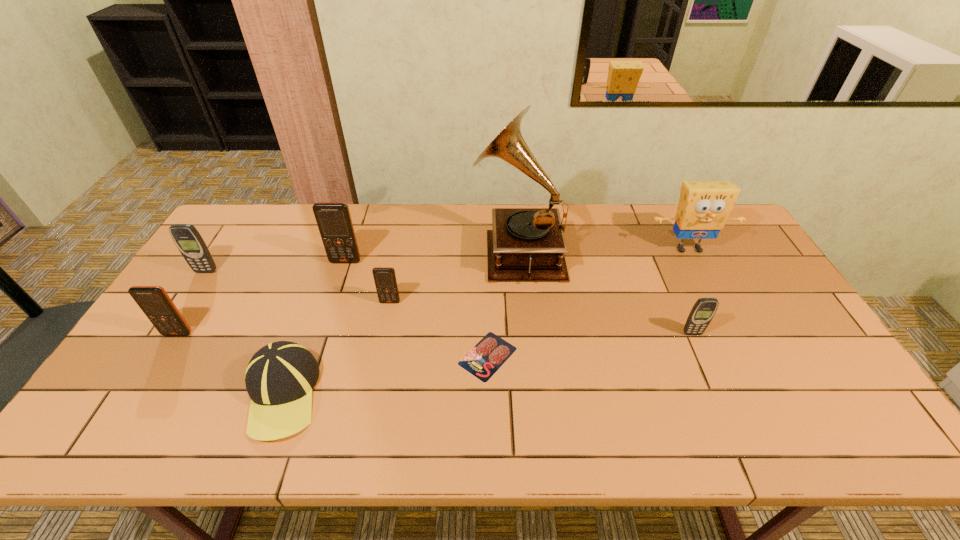
I want to click on free space located 0.050m on the screen of the farthest orange cellular telephone, so click(341, 275).

You are a GUI agent. You are given a task and a screenshot of the screen. Output one action in this format:
    pyautogui.click(x=<x>, y=<y>)
    Task: Click on the free space located 0.400m on the screen of the second farthest cellular telephone
    
    Given the screenshot: What is the action you would take?
    pyautogui.click(x=132, y=385)

Image resolution: width=960 pixels, height=540 pixels. Find the location of `vacant space located 0.250m on the screen of the leftmost orange cellular telephone`. vacant space located 0.250m on the screen of the leftmost orange cellular telephone is located at coordinates (122, 423).

Locate an element on the screen. free space located on the screen of the fifth nearest object is located at coordinates (373, 385).

Identify the location of blank area located on the screen of the smaller gray cellular telephone. The image size is (960, 540). (711, 376).

Locate an element on the screen. vacant space located on the left of the shortest object is located at coordinates (412, 356).

Find the location of a particular element. The height and width of the screenshot is (540, 960). record player that is at the far edge is located at coordinates (526, 244).

Where is `sponge present at the far edge`? The width and height of the screenshot is (960, 540). sponge present at the far edge is located at coordinates (703, 208).

You are a GUI agent. You are given a task and a screenshot of the screen. Output one action in this format:
    pyautogui.click(x=<x>, y=<y>)
    Task: Click on the object that is at the near edge
    This screenshot has width=960, height=540.
    Given the screenshot: What is the action you would take?
    pyautogui.click(x=279, y=379)

I want to click on object present at the right edge, so click(x=703, y=208).